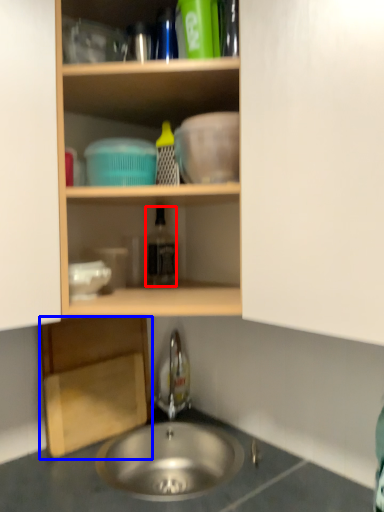
Question: Among these objects, which one is farthest to the camera, bottle (highlighted by a red box) or cabinetry (highlighted by a blue box)?

Choices:
 (A) bottle
 (B) cabinetry

Answer: (A)